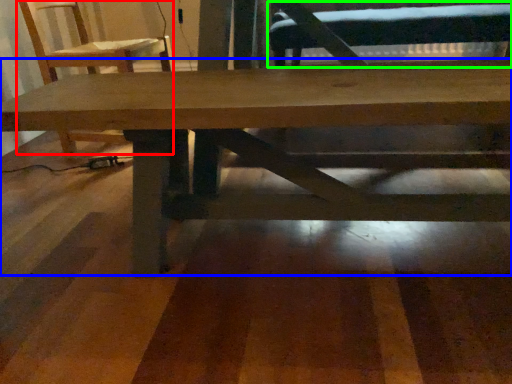
Question: Which is nearer to the chair (highlighted by a red box)? table (highlighted by a blue box) or swivel chair (highlighted by a green box).

Choices:
 (A) table
 (B) swivel chair

Answer: (A)